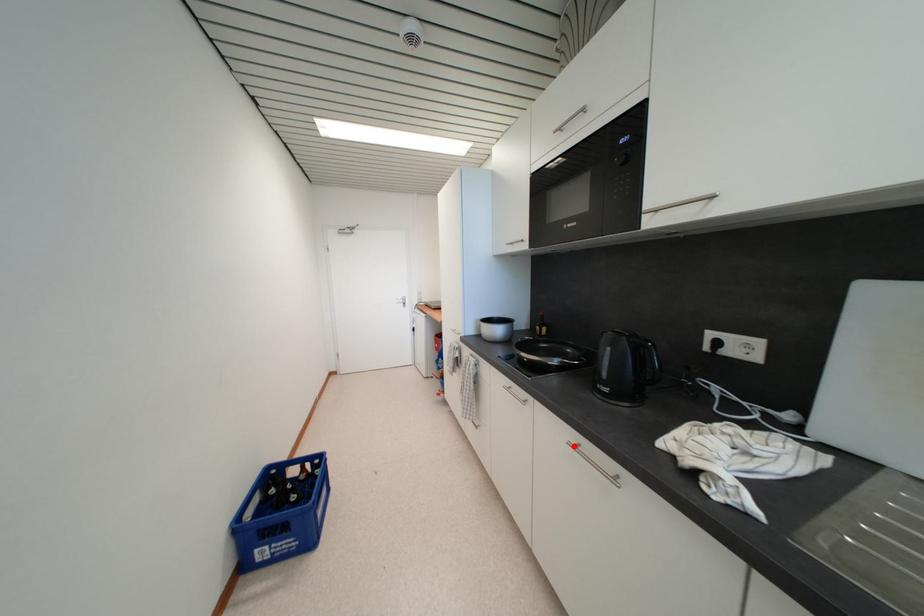
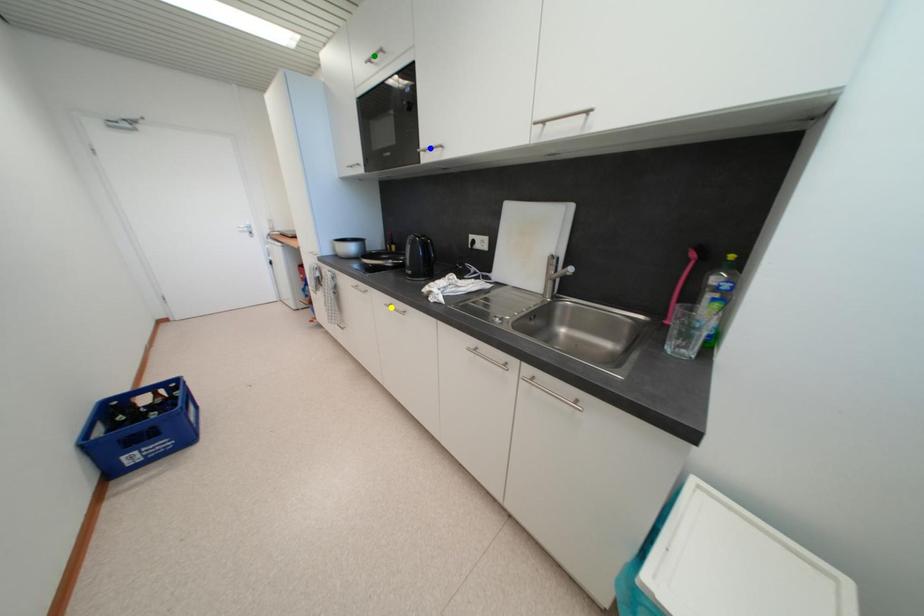
Question: I am providing you with two images of the same scene from different viewpoints. A red point is marked on the first image. You are given multiple points on the second image. Which point in image 2 is actually the same real-world point as the red point in image 1?

Choices:
 (A) yellow point
 (B) blue point
 (C) green point

Answer: (A)